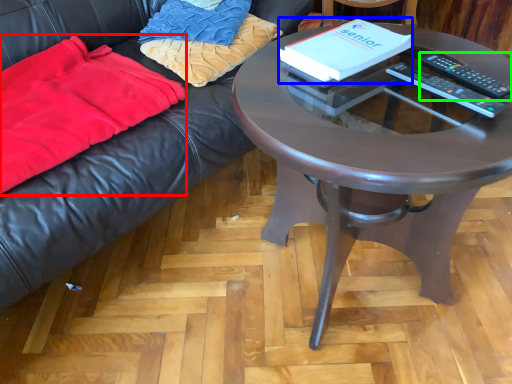
Question: Which object is positioned farthest from blanket (highlighted by a red box)? Select from paperback book (highlighted by a blue box) and remote control (highlighted by a green box).

Choices:
 (A) paperback book
 (B) remote control

Answer: (B)